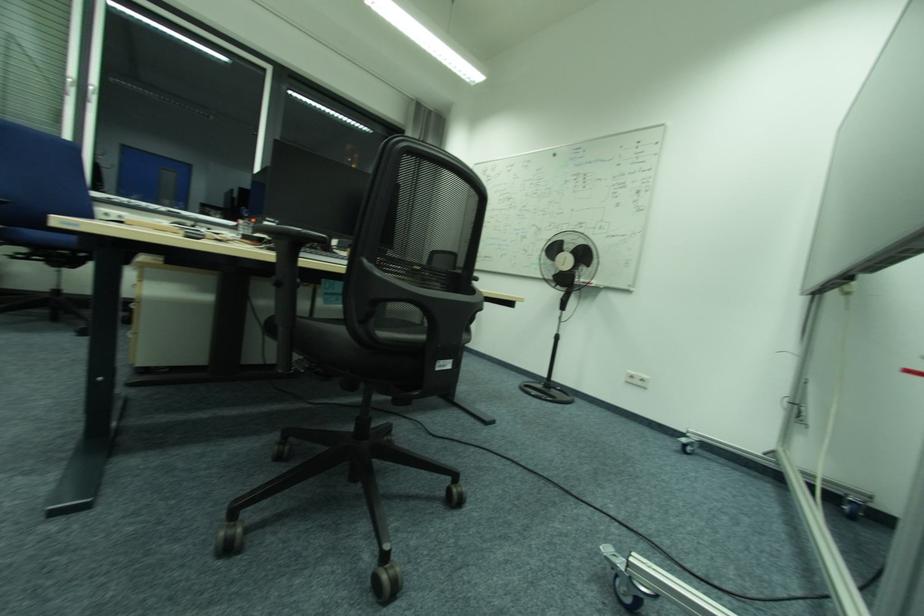
Locate an element on the screen. white window handle is located at coordinates (93, 91).